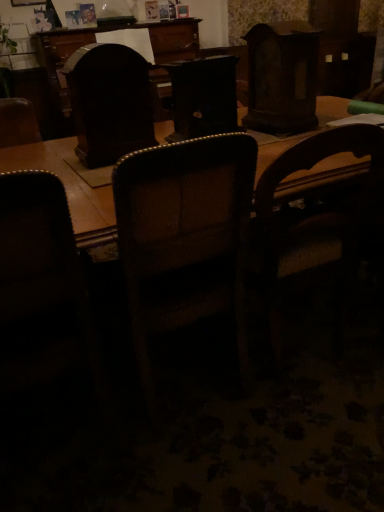
Locate an element on the screen. vacant space to the left of dark wood swivel chair at center is located at coordinates (62, 165).